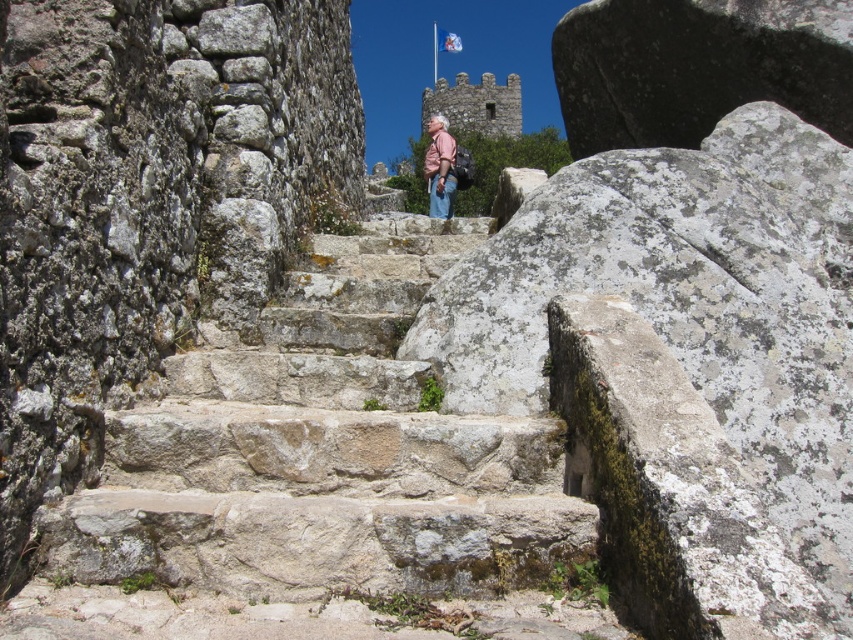
Question: Is natural stone stairs at center above pink fabric shirt at center?

Choices:
 (A) yes
 (B) no

Answer: (B)

Question: Is stone castle at upper center smaller than pink fabric shirt at center?

Choices:
 (A) no
 (B) yes

Answer: (A)

Question: Considering the real-world distances, which object is closest to the stone castle at upper center?

Choices:
 (A) pink fabric shirt at center
 (B) natural stone stairs at center

Answer: (A)

Question: Considering the real-world distances, which object is closest to the stone castle at upper center?

Choices:
 (A) natural stone stairs at center
 (B) pink fabric shirt at center

Answer: (B)

Question: Which object is farther from the camera taking this photo?

Choices:
 (A) stone castle at upper center
 (B) pink fabric shirt at center

Answer: (A)

Question: Does stone castle at upper center appear on the left side of pink fabric shirt at center?

Choices:
 (A) no
 (B) yes

Answer: (A)